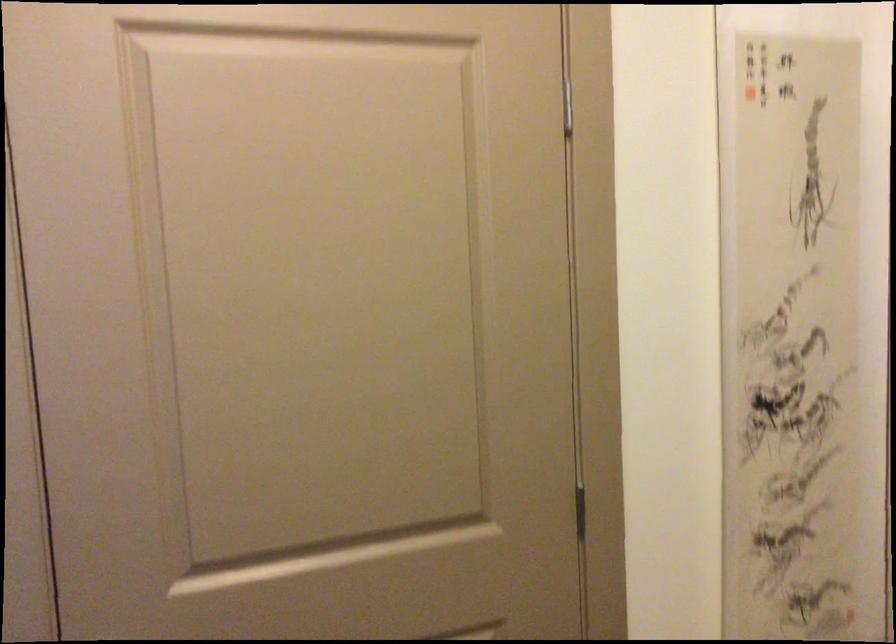
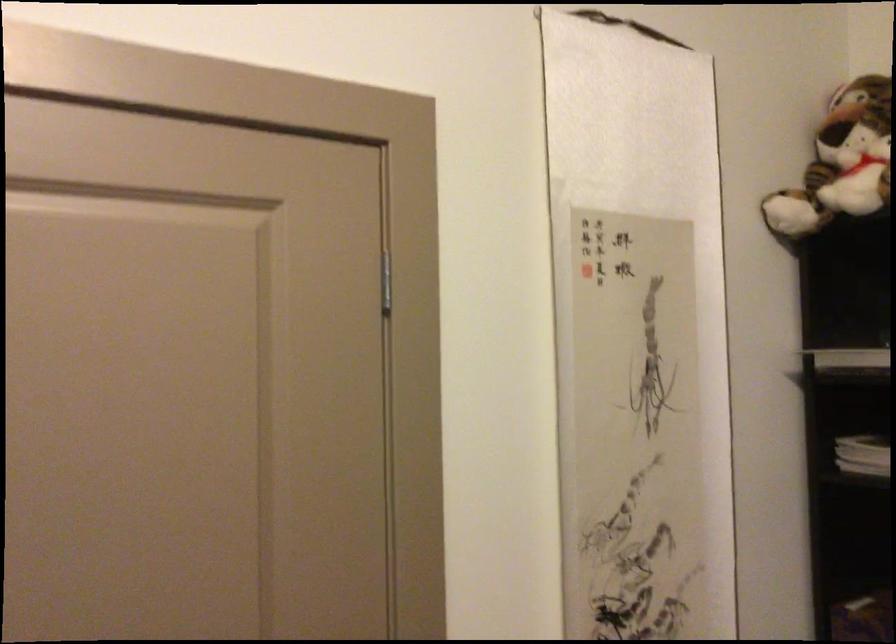
Question: The camera is either moving clockwise (left) or counter-clockwise (right) around the object. The first image is from the beginning of the video and the second image is from the end. Is the camera moving left or right when shooting the video?

Choices:
 (A) Left
 (B) Right

Answer: (A)